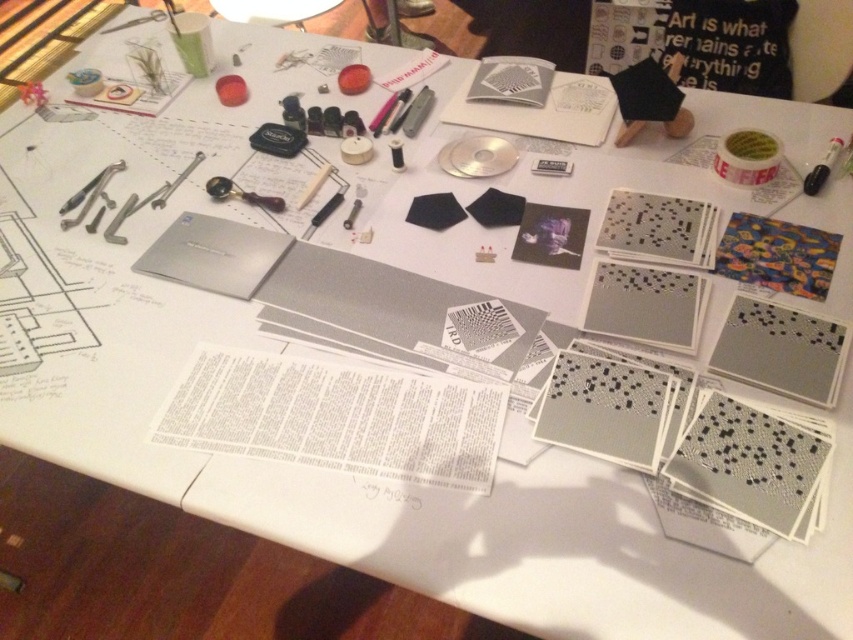
Question: Where is metallic silver wrench at left located in relation to black marker at upper right in the image?

Choices:
 (A) left
 (B) right

Answer: (A)

Question: Which point is closer to the camera?

Choices:
 (A) (825, 179)
 (B) (262, 196)

Answer: (A)

Question: Which object is the closest to the metallic silver wrench at left?

Choices:
 (A) metallic silver pen at center
 (B) black marker at upper right
 (C) metallic gray pen at center
 (D) metallic keychain at center

Answer: (D)

Question: Which point is farther to the camera?

Choices:
 (A) metallic silver wrench at left
 (B) metallic silver pen at center
 (C) metallic gray pen at center
 (D) metallic keychain at center

Answer: (C)

Question: Does metallic keychain at center have a lesser width compared to metallic gray pen at center?

Choices:
 (A) yes
 (B) no

Answer: (B)

Question: Is metallic keychain at center smaller than black marker at upper right?

Choices:
 (A) yes
 (B) no

Answer: (A)